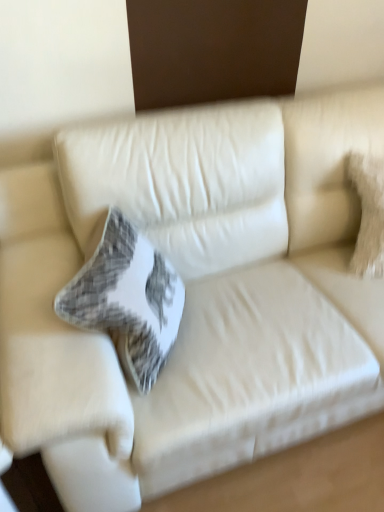
Measure the distance between point (95, 279) and camera.

They are 3.33 feet apart.

What do you see at coordinates (127, 298) in the screenshot?
I see `plaid fabric pillow at center` at bounding box center [127, 298].

What is the approximate height of plaid fabric pillow at center?

plaid fabric pillow at center is 12.03 inches in height.

Locate an element on the screen. The image size is (384, 512). plaid fabric pillow at center is located at coordinates (127, 298).

Locate an element on the screen. Image resolution: width=384 pixels, height=512 pixels. plaid fabric pillow at center is located at coordinates (127, 298).